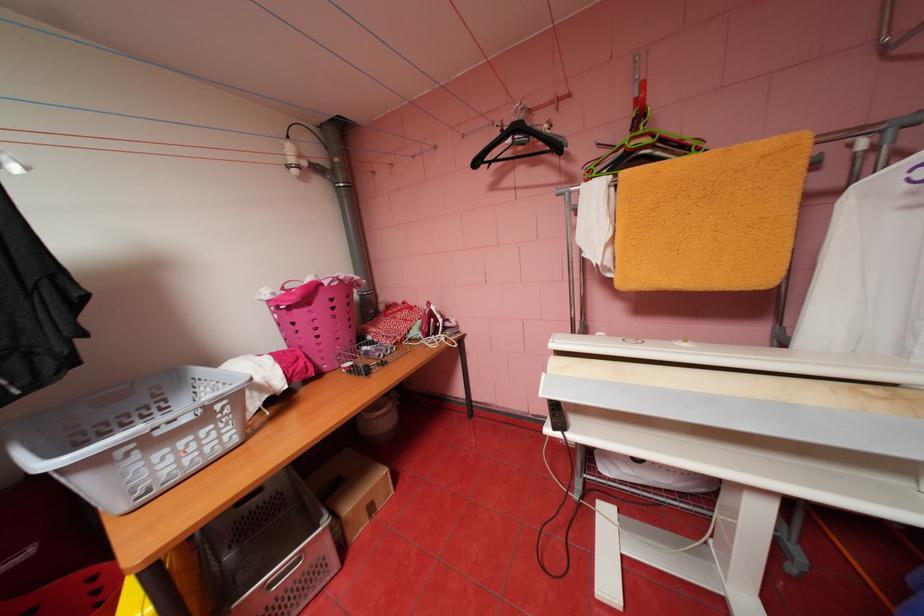
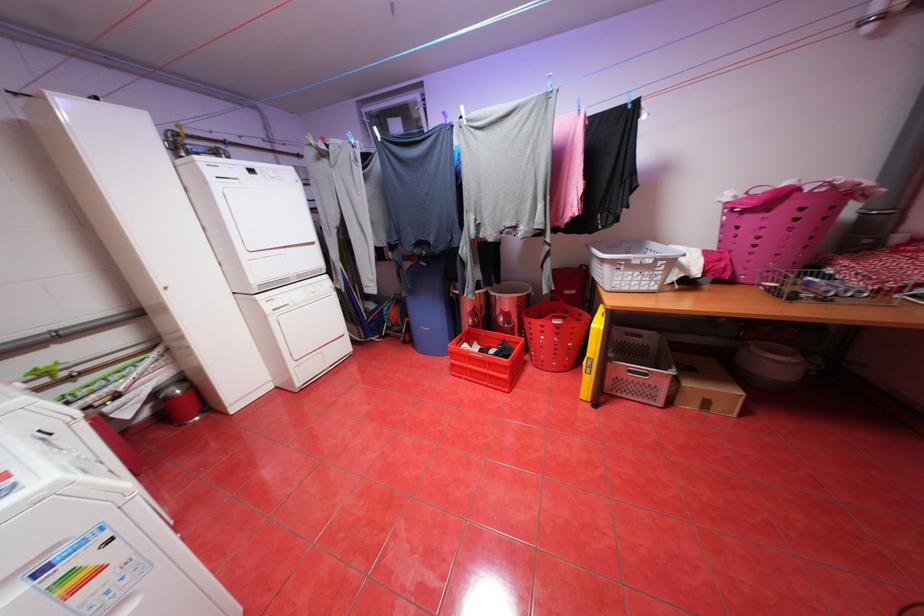
How did the camera likely rotate?

The camera's rotation is toward left-down.